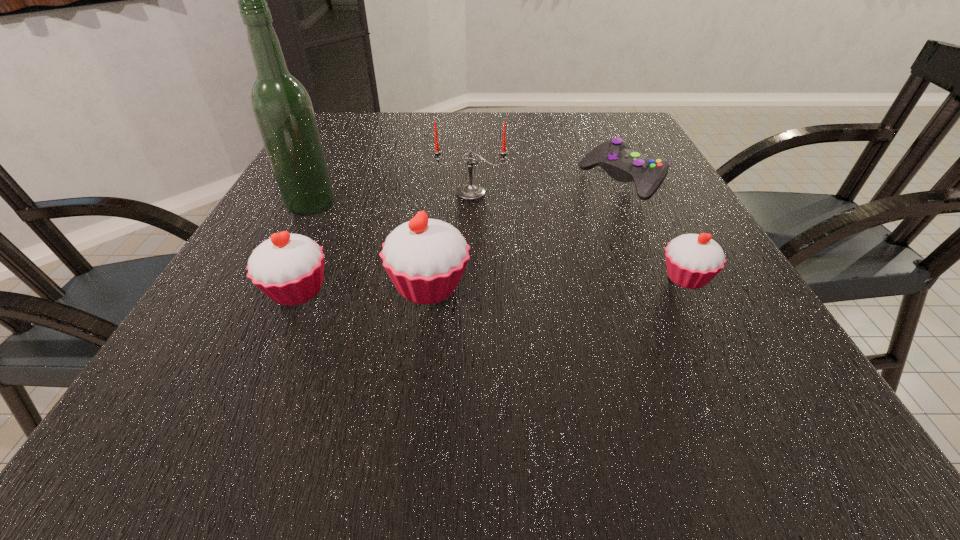
Identify which object is located as the second nearest to the tallest cupcake. Please provide its 2D coordinates. Your answer should be formatted as a tuple, i.e. [(x, y)], where the tuple contains the x and y coordinates of a point satisfying the conditions above.

[(282, 108)]

Find the location of a particular element. This screenshot has width=960, height=540. object that is the fifth closest to the fifth tallest object is located at coordinates (282, 108).

Identify which cupcake is located as the nearest to the liquor. Please provide its 2D coordinates. Your answer should be formatted as a tuple, i.e. [(x, y)], where the tuple contains the x and y coordinates of a point satisfying the conditions above.

[(289, 268)]

Identify the location of cupcake that is the closest to the tallest cupcake. (289, 268).

At what (x,y) coordinates should I click in order to perform the action: click on free space that satisfies the following two spatial constraints: 1. on the back side of the tallest cupcake; 2. on the right side of the control. Please return your answer as a coordinate pair (x, y). The image size is (960, 540). Looking at the image, I should click on (443, 180).

Locate an element on the screen. The image size is (960, 540). vacant space that satisfies the following two spatial constraints: 1. on the front side of the liquor; 2. on the left side of the second shortest cupcake is located at coordinates (267, 291).